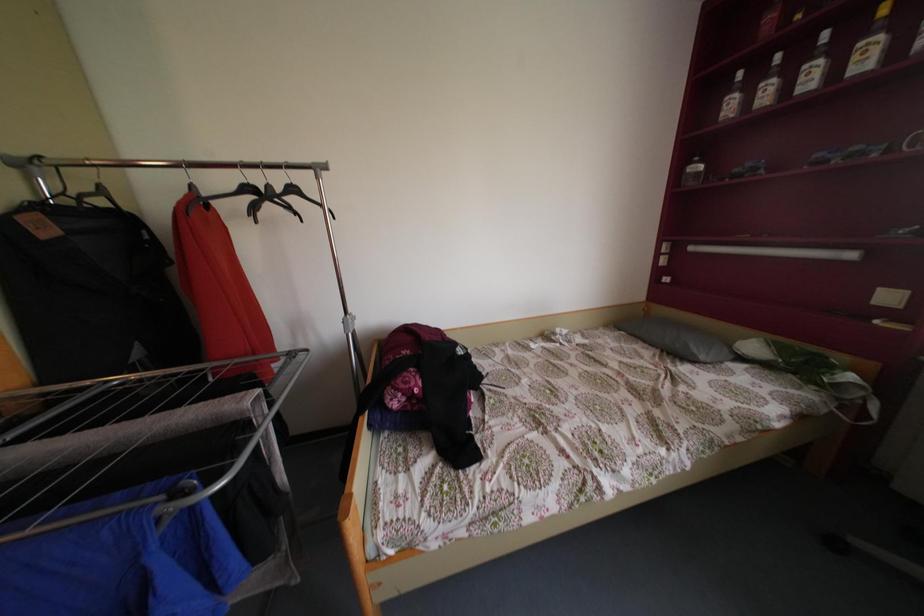
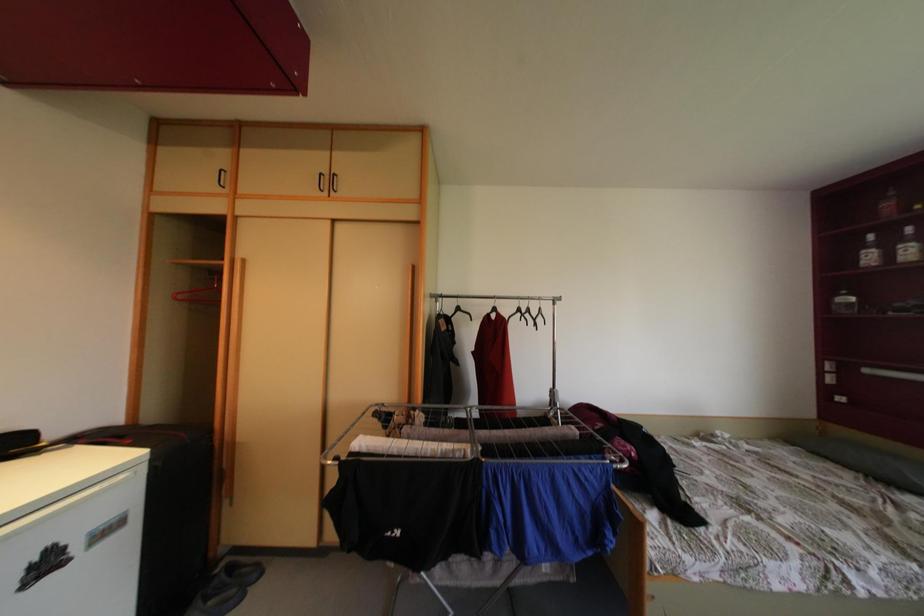
What movement of the cameraman would produce the second image?

The movement direction of the cameraman is left, backward.